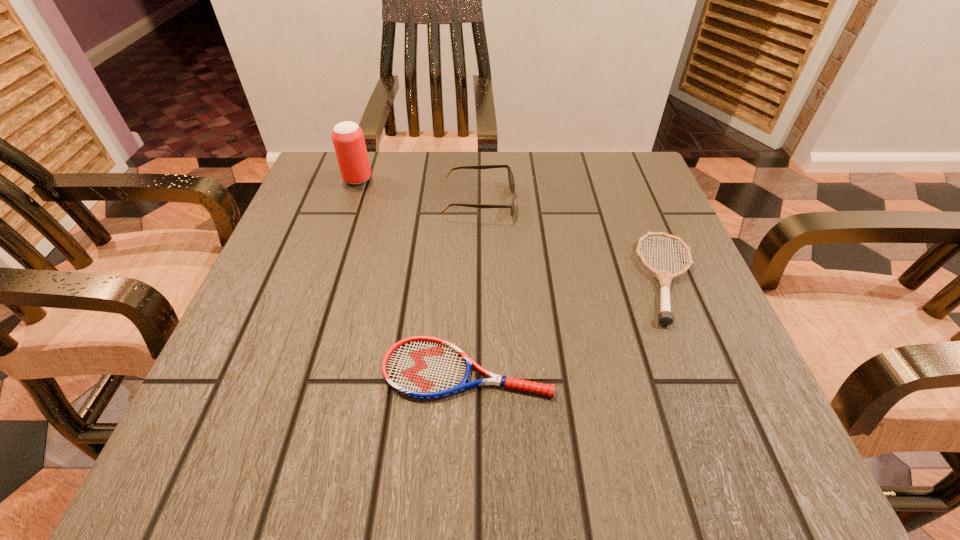
Find the location of a particular element. free space between the second tallest object and the left tennis racket is located at coordinates (473, 285).

The width and height of the screenshot is (960, 540). What are the coordinates of `free space between the third tallest object and the second tallest object` in the screenshot? It's located at (574, 240).

You are a GUI agent. You are given a task and a screenshot of the screen. Output one action in this format:
    pyautogui.click(x=<x>, y=<y>)
    Task: Click on the unoccupied position between the sunglasses and the leftmost object
    Image resolution: width=960 pixels, height=540 pixels.
    Given the screenshot: What is the action you would take?
    pyautogui.click(x=419, y=190)

Locate which object ranks second in proximity to the sunglasses. Please provide its 2D coordinates. Your answer should be formatted as a tuple, i.e. [(x, y)], where the tuple contains the x and y coordinates of a point satisfying the conditions above.

[(665, 317)]

Select which object is the second closest to the sunglasses. Please provide its 2D coordinates. Your answer should be formatted as a tuple, i.e. [(x, y)], where the tuple contains the x and y coordinates of a point satisfying the conditions above.

[(665, 317)]

You are a GUI agent. You are given a task and a screenshot of the screen. Output one action in this format:
    pyautogui.click(x=<x>, y=<y>)
    Task: Click on the free space that satisfies the following two spatial constraints: 1. on the back side of the left tennis racket; 2. on the left side of the farther tennis racket
    
    Given the screenshot: What is the action you would take?
    pyautogui.click(x=469, y=278)

Find the location of a particular element. vacant point that satisfies the following two spatial constraints: 1. on the front side of the tallest object; 2. on the right side of the nearer tennis racket is located at coordinates (293, 369).

You are a GUI agent. You are given a task and a screenshot of the screen. Output one action in this format:
    pyautogui.click(x=<x>, y=<y>)
    Task: Click on the free spot that satisfies the following two spatial constraints: 1. on the front side of the tallest object; 2. on the left side of the third farthest object
    This screenshot has width=960, height=540.
    Given the screenshot: What is the action you would take?
    click(324, 278)